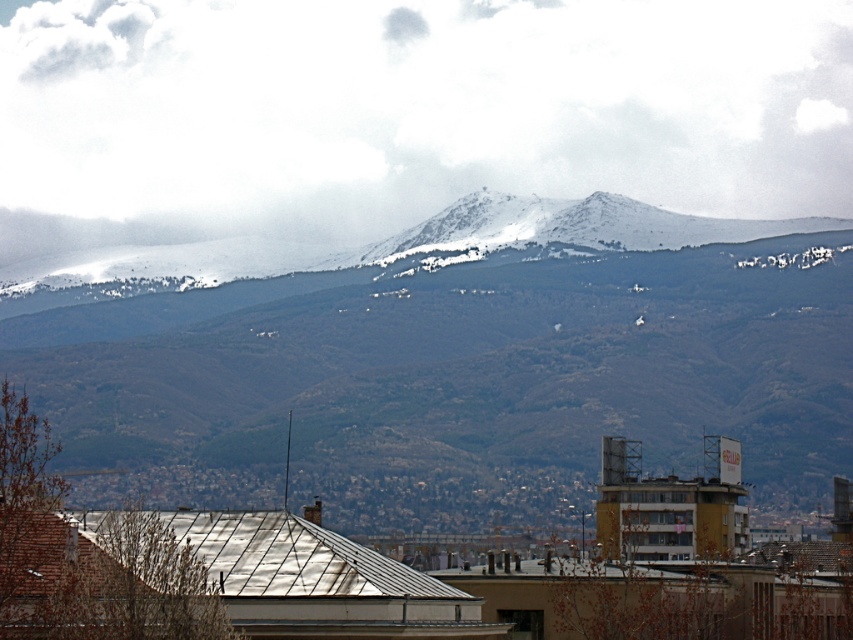
Question: Does snowy mountain range at upper center come in front of white fluffy cloud at upper center?

Choices:
 (A) yes
 (B) no

Answer: (A)

Question: Which object is farther from the camera taking this photo?

Choices:
 (A) white fluffy cloud at upper center
 (B) snowy mountain range at upper center

Answer: (A)

Question: Is snowy mountain range at upper center thinner than white fluffy cloud at upper center?

Choices:
 (A) no
 (B) yes

Answer: (B)

Question: Which of the following is the farthest from the observer?

Choices:
 (A) (341, 403)
 (B) (109, 113)

Answer: (B)

Question: Does snowy mountain range at upper center appear over white fluffy cloud at upper center?

Choices:
 (A) no
 (B) yes

Answer: (A)